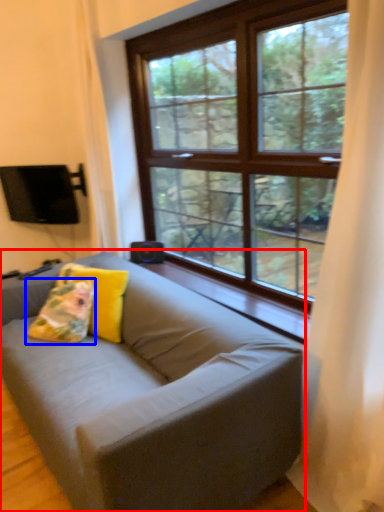
Question: Among these objects, which one is nearest to the camera, studio couch (highlighted by a red box) or pillow (highlighted by a blue box)?

Choices:
 (A) studio couch
 (B) pillow

Answer: (A)